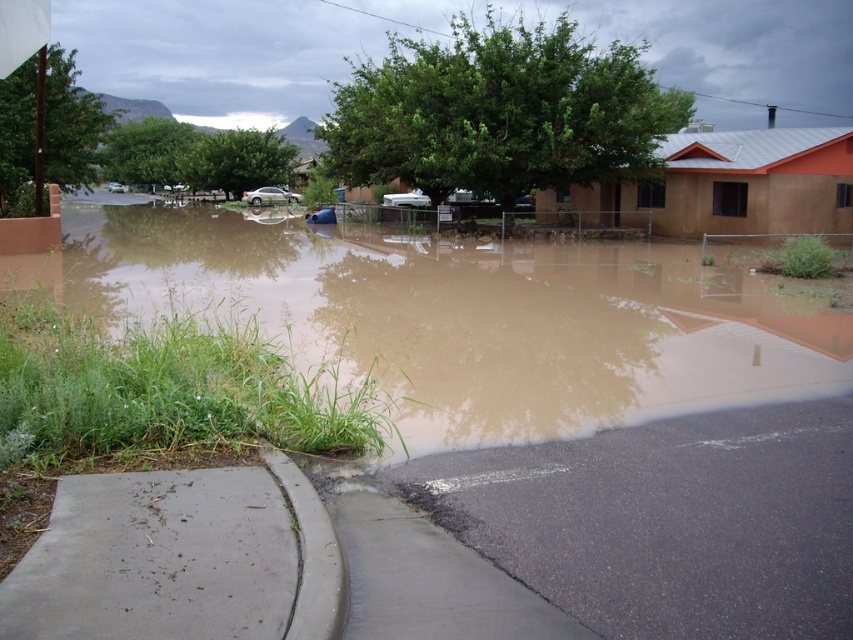
Who is more distant from viewer, [223,288] or [550,604]?

Point [223,288]

Who is higher up, brown muddy water at lower left or gray asphalt at lower center?

Positioned higher is brown muddy water at lower left.

Does point (753, 323) come in front of point (486, 580)?

That is False.

The width and height of the screenshot is (853, 640). Find the location of `brown muddy water at lower left`. brown muddy water at lower left is located at coordinates (469, 316).

The width and height of the screenshot is (853, 640). What do you see at coordinates (469, 316) in the screenshot?
I see `brown muddy water at lower left` at bounding box center [469, 316].

In the scene shown: Who is more distant from viewer, (759, 296) or (308, 547)?

The point (759, 296) is more distant.

Which is behind, point (471, 273) or point (305, 627)?

The point (471, 273) is more distant.

This screenshot has width=853, height=640. I want to click on brown muddy water at lower left, so click(469, 316).

Can you confirm if gray asphalt at lower center is shorter than gray concrete curb at lower left?

Correct, gray asphalt at lower center is not as tall as gray concrete curb at lower left.

Between point (358, 589) and point (271, 445), which one is positioned in front?

Positioned in front is point (358, 589).

This screenshot has height=640, width=853. Identify the location of gray asphalt at lower center. (428, 579).